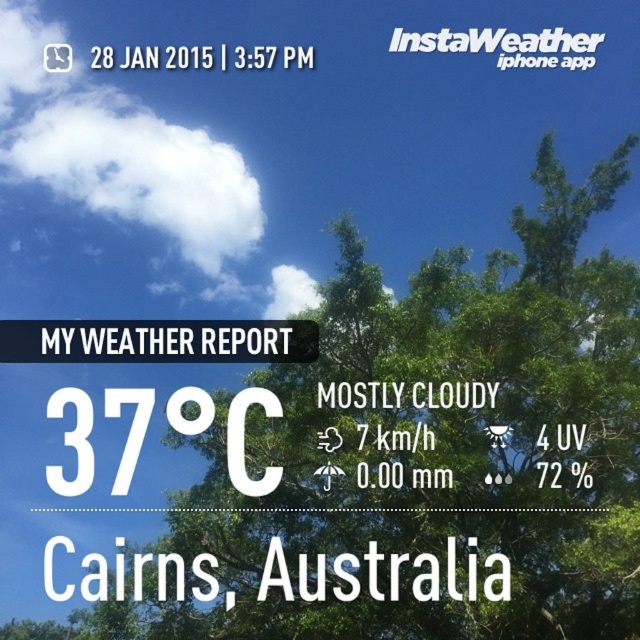
Can you confirm if green leafy tree at upper center is positioned to the right of white fluffy cloud at upper left?

Yes, green leafy tree at upper center is to the right of white fluffy cloud at upper left.

Between point (234, 515) and point (180, 204), which one is positioned in front?

Positioned in front is point (234, 515).

Locate an element on the screen. The image size is (640, 640). green leafy tree at upper center is located at coordinates (445, 436).